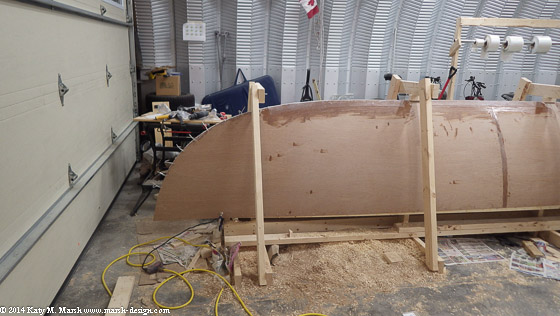
What are the coordinates of `newspaper` in the screenshot? It's located at click(477, 254), click(522, 264).